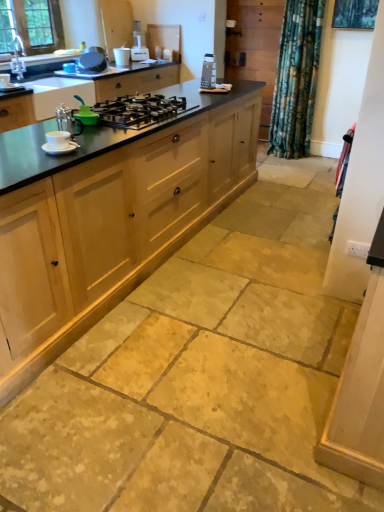
You are a GUI agent. You are given a task and a screenshot of the screen. Output one action in this format:
    pyautogui.click(x=<x>, y=<y>)
    Task: Click on the spots to the right of natural wood cabinetry at center
    The width and height of the screenshot is (384, 512).
    Given the screenshot: What is the action you would take?
    pyautogui.click(x=262, y=239)